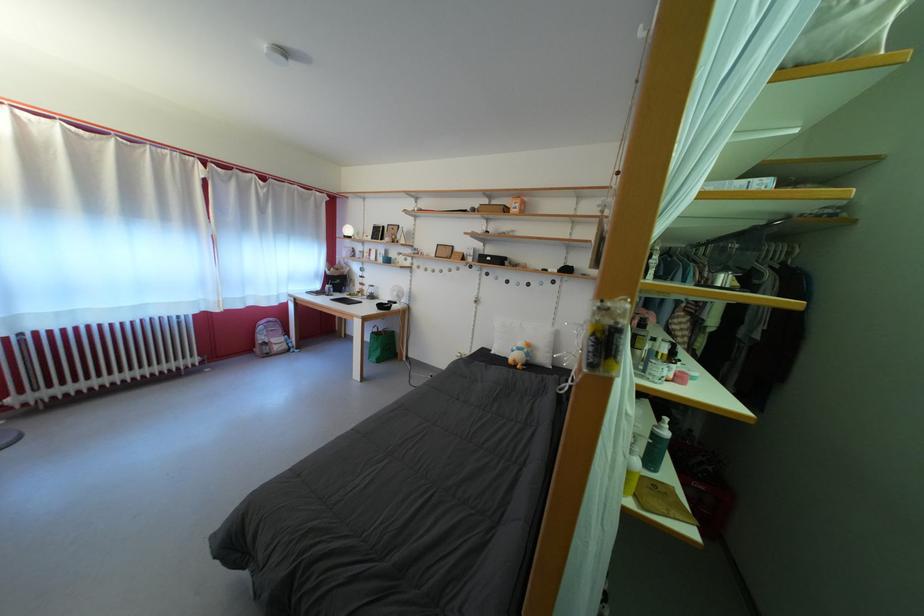
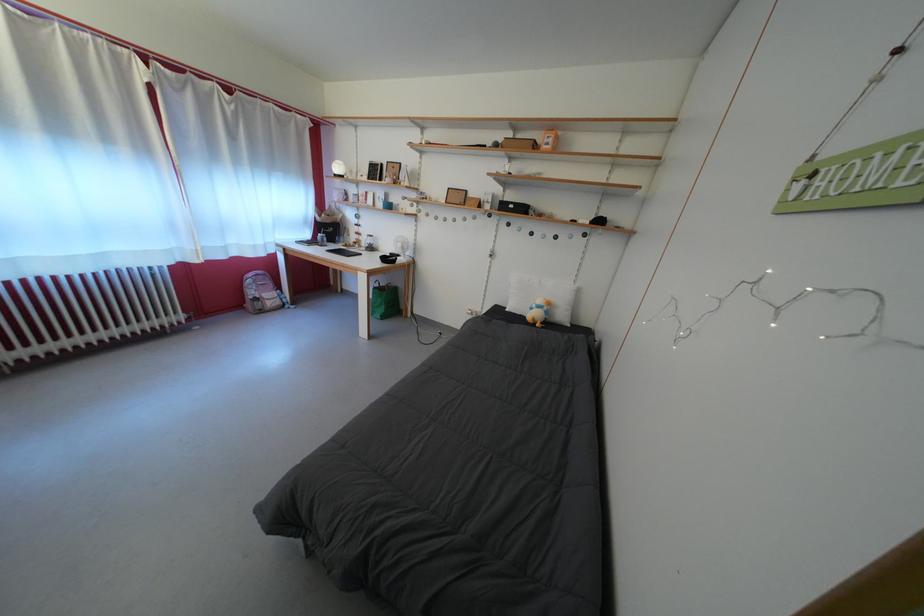
Find the pixel in the second image that matches point (524, 354) in the first image.

(542, 312)